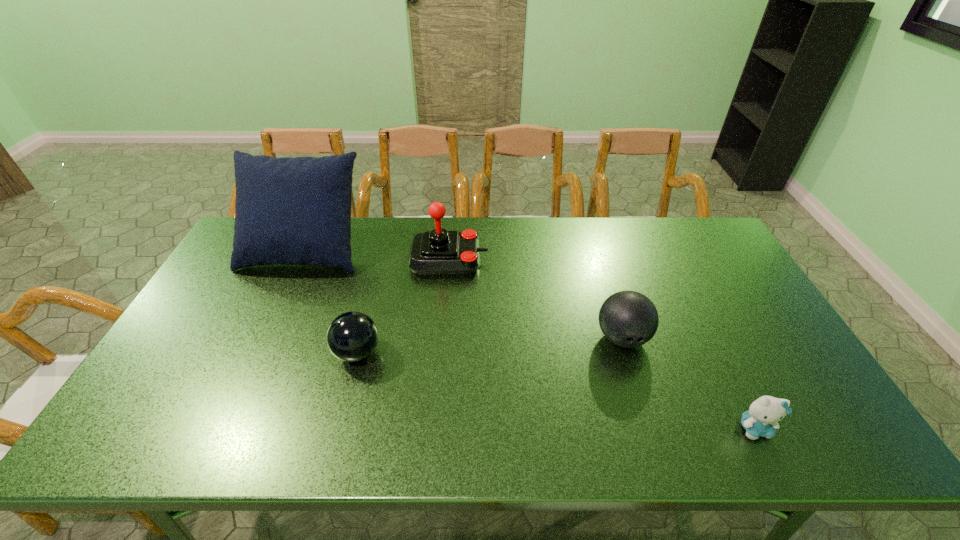
Find the location of a particular element. This screenshot has height=540, width=960. the tallest object is located at coordinates (289, 211).

In order to click on the leftmost object in this screenshot , I will do `click(289, 211)`.

Identify the location of the fourth shortest object. (437, 252).

Where is `joystick`? joystick is located at coordinates (437, 252).

Identify the location of the right bowling ball. This screenshot has width=960, height=540. (629, 319).

The height and width of the screenshot is (540, 960). Find the location of `the second object from left to right`. the second object from left to right is located at coordinates (352, 336).

I want to click on the shorter bowling ball, so click(352, 336).

Where is `the shortest object`? This screenshot has height=540, width=960. the shortest object is located at coordinates (761, 419).

You are a GUI agent. You are given a task and a screenshot of the screen. Output one action in this format:
    pyautogui.click(x=<x>, y=<y>)
    Task: Click on the kitten
    The height and width of the screenshot is (540, 960).
    Given the screenshot: What is the action you would take?
    pyautogui.click(x=761, y=419)

You are a GUI agent. You are given a task and a screenshot of the screen. Output one action in this format:
    pyautogui.click(x=<x>, y=<y>)
    Task: Click on the free space located 0.060m on the facing side of the leftmost object
    
    Given the screenshot: What is the action you would take?
    pyautogui.click(x=286, y=287)